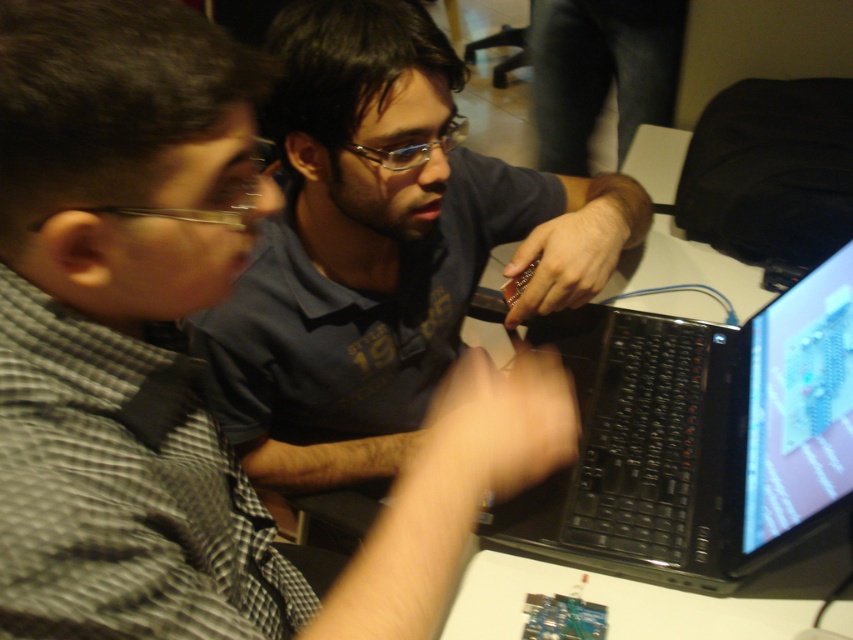
Which is below, black matte laptop at center or shiny plastic monitor at upper right?

black matte laptop at center

Does black matte laptop at center have a lesser width compared to shiny plastic monitor at upper right?

Incorrect, black matte laptop at center's width is not less than shiny plastic monitor at upper right's.

Image resolution: width=853 pixels, height=640 pixels. Describe the element at coordinates (703, 445) in the screenshot. I see `black matte laptop at center` at that location.

Where is `black matte laptop at center`? This screenshot has width=853, height=640. black matte laptop at center is located at coordinates (703, 445).

Identify the location of shiny plastic monitor at upper right. The height and width of the screenshot is (640, 853). (799, 403).

Does shiny plastic monitor at upper right come in front of dark blue jeans at center?

That is True.

You are a GUI agent. You are given a task and a screenshot of the screen. Output one action in this format:
    pyautogui.click(x=<x>, y=<y>)
    Task: Click on the shiny plastic monitor at upper right
    This screenshot has width=853, height=640.
    Given the screenshot: What is the action you would take?
    pyautogui.click(x=799, y=403)

Between matte black shirt at center and dark blue jeans at center, which one is positioned higher?

Positioned higher is dark blue jeans at center.

The width and height of the screenshot is (853, 640). Describe the element at coordinates (381, 248) in the screenshot. I see `matte black shirt at center` at that location.

At what (x,y) coordinates should I click in order to perform the action: click on matte black shirt at center. Please return your answer as a coordinate pair (x, y). The image size is (853, 640). Looking at the image, I should click on (381, 248).